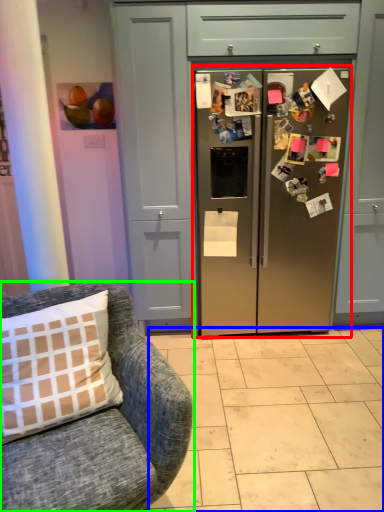
Question: Which object is positioned farthest from refrigerator (highlighted by a red box)? Select from tile (highlighted by a blue box) and chair (highlighted by a green box).

Choices:
 (A) tile
 (B) chair

Answer: (B)